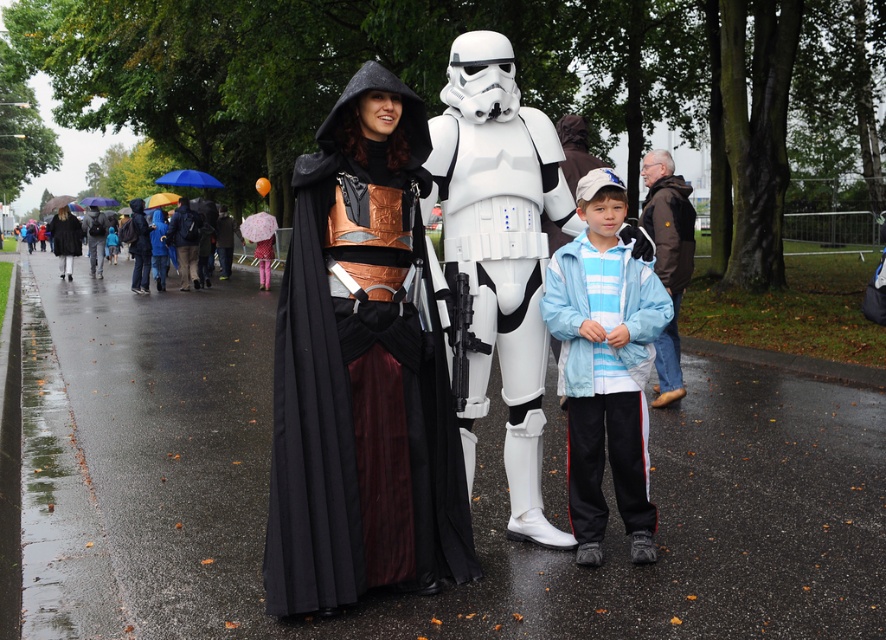
Question: Can you confirm if white matte stormtrooper armor at center is thinner than blue fabric umbrella at center?

Choices:
 (A) no
 (B) yes

Answer: (A)

Question: Does light blue fabric jacket at center appear on the right side of brown leather jacket at center?

Choices:
 (A) yes
 (B) no

Answer: (B)

Question: Which object is positioned farthest from the blue fabric umbrella at center?

Choices:
 (A) blue fabric umbrella at upper center
 (B) brown leather jacket at center

Answer: (A)

Question: Estimate the real-world distances between objects in this image. Which object is closer to the matte black jacket at center?

Choices:
 (A) light blue fabric jacket at center
 (B) matte black cloak at left
 (C) blue fabric umbrella at upper left

Answer: (B)

Question: Can you confirm if white matte stormtrooper armor at center is positioned above blue fabric umbrella at center?

Choices:
 (A) no
 (B) yes

Answer: (A)

Question: Which of the following is the farthest from the observer?

Choices:
 (A) (200, 186)
 (B) (100, 196)

Answer: (B)